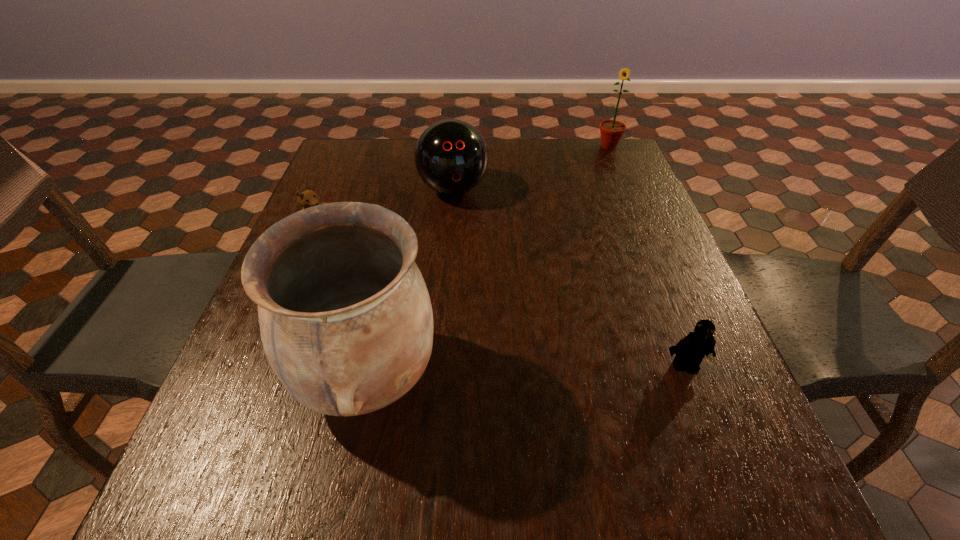
The width and height of the screenshot is (960, 540). I want to click on vacant space that satisfies the following two spatial constraints: 1. on the back side of the third tallest object; 2. on the left side of the urn, so click(x=407, y=189).

Find the location of a particular element. This screenshot has width=960, height=540. free space that satisfies the following two spatial constraints: 1. on the back side of the fourth shortest object; 2. on the right side of the urn is located at coordinates (416, 146).